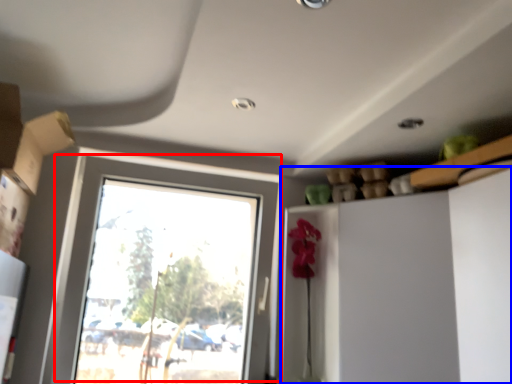
Question: Among these objects, which one is nearest to the camera, window (highlighted by a red box) or dresser (highlighted by a blue box)?

Choices:
 (A) window
 (B) dresser

Answer: (B)